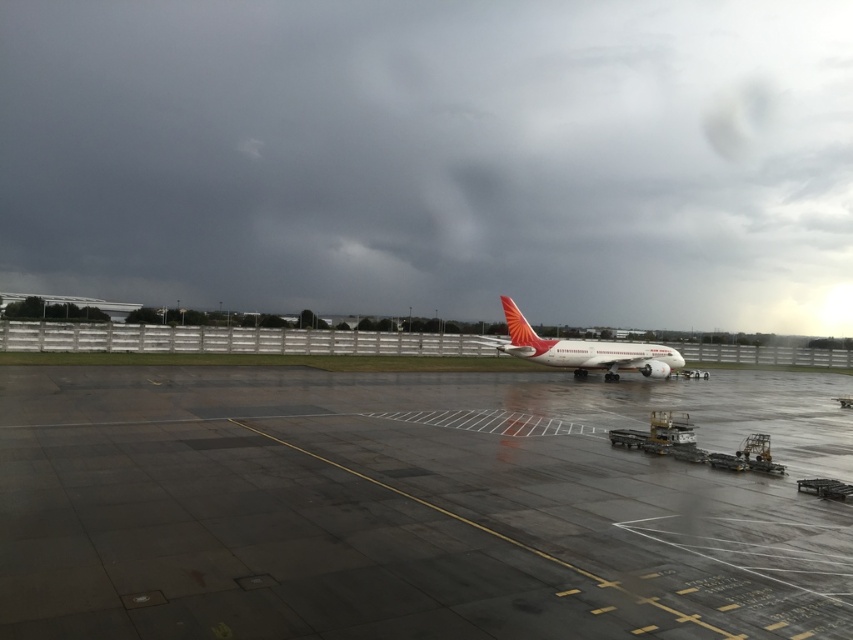
From the picture: You are a pilot preparing for takeoff and notice the dark gray cloud at upper center and the concrete wet tarmac at center. Based on their positions, which one is higher in the sky?

The dark gray cloud at upper center is higher in the sky than the concrete wet tarmac at center because the description states that the dark gray cloud at upper center has a greater height compared to the concrete wet tarmac at center.

Consider the image. You are a pilot preparing for takeoff and notice the dark gray cloud at upper center and the white matte airplane at center. Which object is higher in the sky?

The dark gray cloud at upper center is higher in the sky than the white matte airplane at center because the description states that the dark gray cloud at upper center has a greater height compared to the white matte airplane at center.